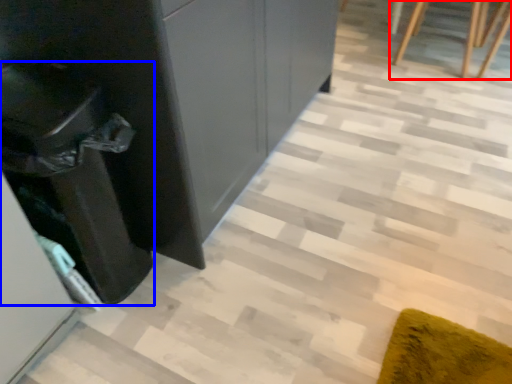
Question: Which object appears farthest to the camera in this image, furniture (highlighted by a red box) or cabinetry (highlighted by a blue box)?

Choices:
 (A) furniture
 (B) cabinetry

Answer: (A)